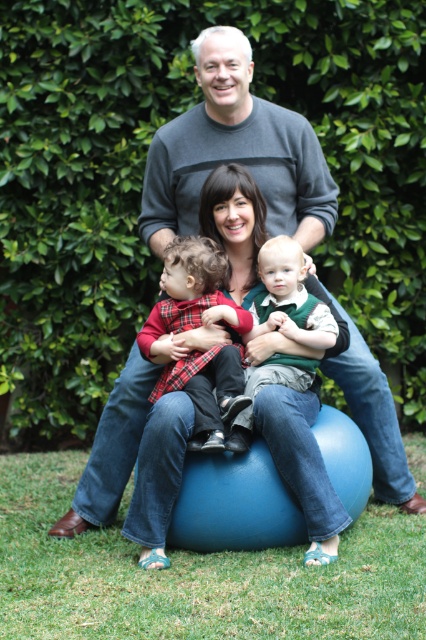
Question: Can you confirm if plaid fabric shirt at center is positioned to the left of green fuzzy vest at center?

Choices:
 (A) no
 (B) yes

Answer: (B)

Question: Among these objects, which one is farthest from the camera?

Choices:
 (A) green fuzzy vest at center
 (B) plaid fabric shirt at center

Answer: (A)

Question: Does gray sweater at upper center appear on the left side of plaid fabric shirt at center?

Choices:
 (A) yes
 (B) no

Answer: (B)

Question: Is plaid fabric shirt at center to the right of green fuzzy vest at center from the viewer's perspective?

Choices:
 (A) yes
 (B) no

Answer: (B)

Question: Which of the following is the closest to the observer?

Choices:
 (A) plaid fabric shirt at center
 (B) gray sweater at upper center
 (C) green fuzzy vest at center

Answer: (A)

Question: Which object appears closest to the camera in this image?

Choices:
 (A) plaid fabric shirt at center
 (B) gray sweater at upper center

Answer: (A)